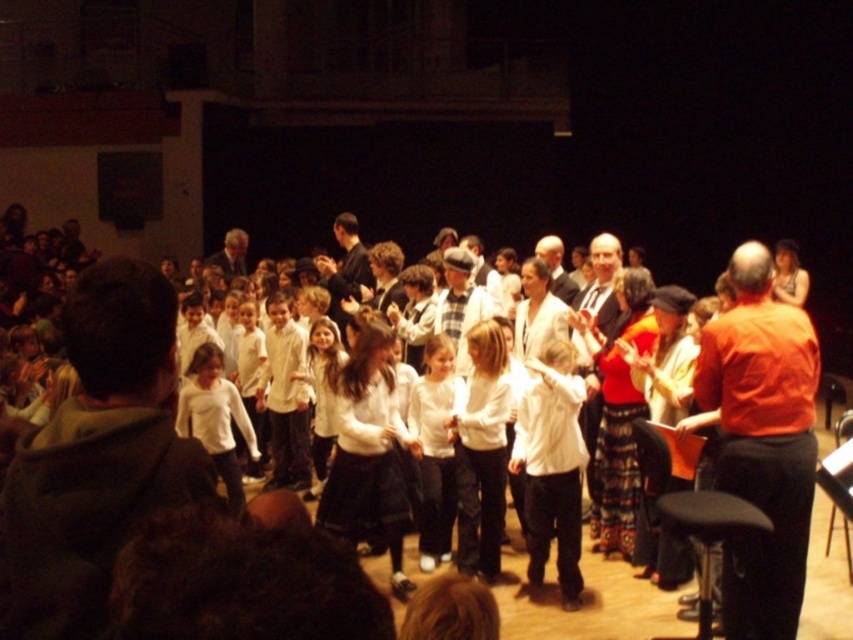
Question: Is orange shirt at right wider than gray wool sweater at center?

Choices:
 (A) no
 (B) yes

Answer: (B)

Question: Which is nearer to the shiny gold necklace at upper center?

Choices:
 (A) orange shirt at right
 (B) plaid fabric hat at center
 (C) white textured sweater at center
 (D) white hoodie at left

Answer: (C)

Question: Considering the real-world distances, which object is closest to the shiny gold necklace at upper center?

Choices:
 (A) white hoodie at left
 (B) white textured sweater at center
 (C) orange shirt at right
 (D) white shirt at center

Answer: (D)

Question: Which point is closer to the camera taking this photo?

Choices:
 (A) (592, 285)
 (B) (544, 250)
 (C) (445, 257)

Answer: (A)

Question: Is white hoodie at left to the left of gray wool sweater at center from the viewer's perspective?

Choices:
 (A) yes
 (B) no

Answer: (B)

Question: Is white hoodie at left positioned at the back of white shirt at center?

Choices:
 (A) yes
 (B) no

Answer: (B)